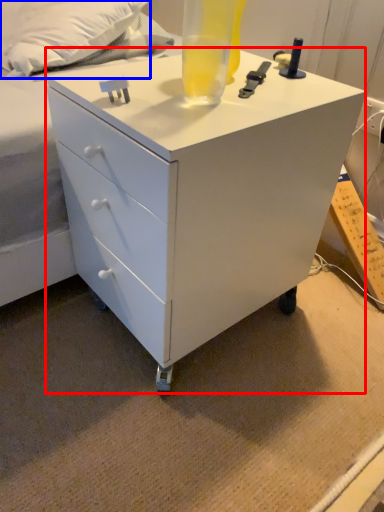
Question: Which point is closer to the camera, chest of drawers (highlighted by a red box) or pillow (highlighted by a blue box)?

Choices:
 (A) chest of drawers
 (B) pillow

Answer: (A)